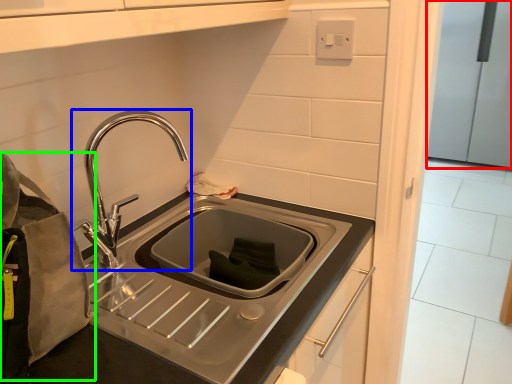
Question: Estimate the real-world distances between objects in this image. Which object is farther from appliance (highlighted by a red box), tap (highlighted by a blue box) or pouch (highlighted by a green box)?

Choices:
 (A) tap
 (B) pouch

Answer: (B)